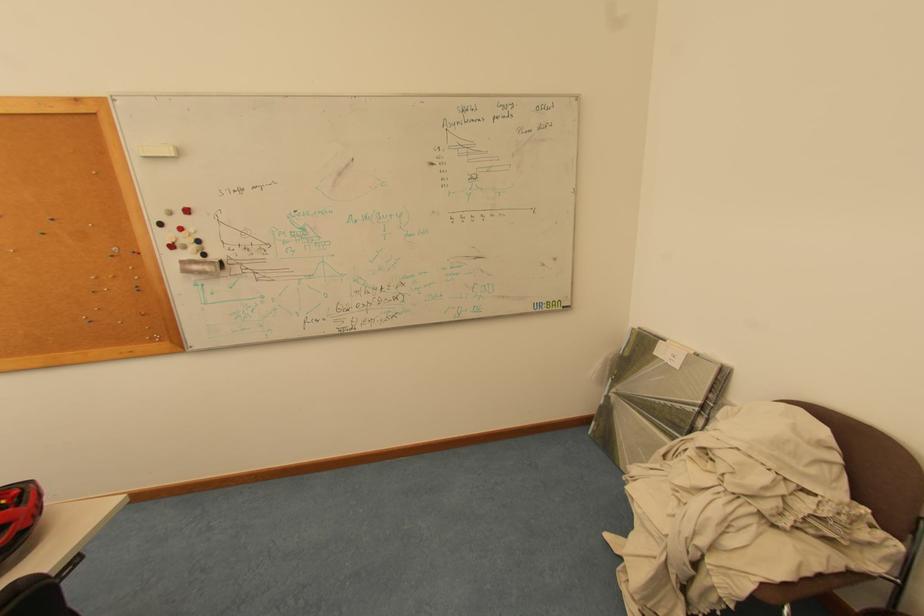
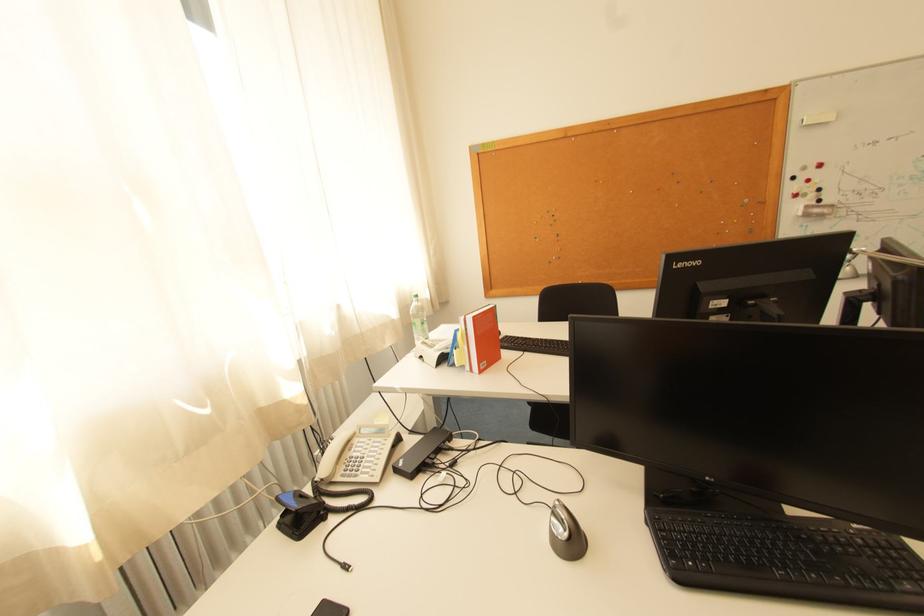
The images are taken continuously from a first-person perspective. In which direction are you moving?

The cameraman moved toward left, backward.